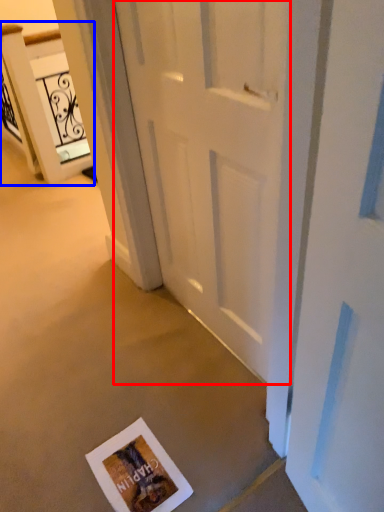
Question: Which object is further to the camera taking this photo, door (highlighted by a red box) or elevator (highlighted by a blue box)?

Choices:
 (A) door
 (B) elevator

Answer: (B)